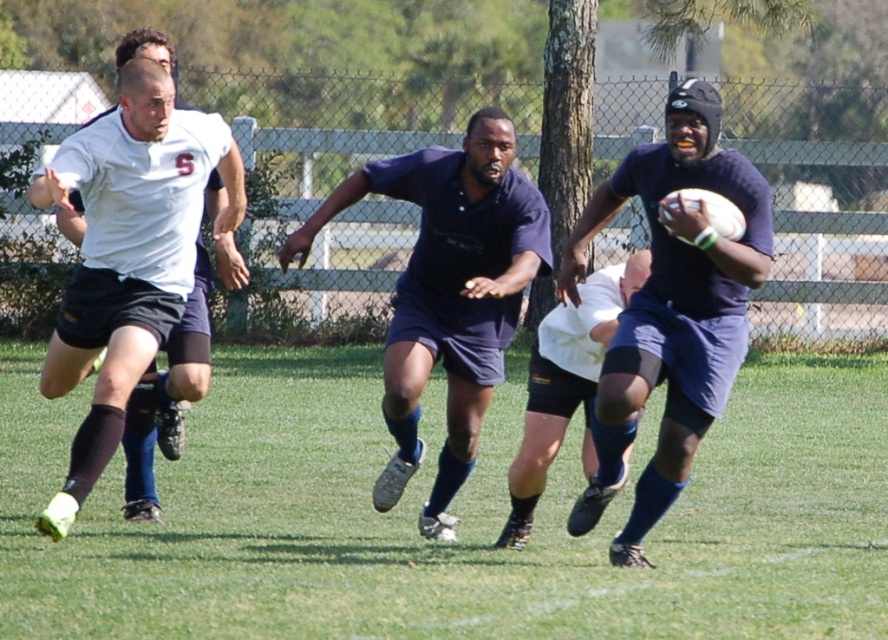
Which is behind, point (597, 545) or point (620, 339)?

The point (597, 545) is more distant.

Is point (720, 481) farther from camera compared to point (672, 109)?

That is True.

Is point (514, 632) farther from camera compared to point (592, 221)?

No, it is not.

The height and width of the screenshot is (640, 888). I want to click on green grass at center, so click(x=450, y=512).

Is dark blue jersey at center smaller than navy blue jersey at center?

Yes.

Can you confirm if dark blue jersey at center is positioned above navy blue jersey at center?

Yes, dark blue jersey at center is above navy blue jersey at center.

Measure the distance between point (639,182) and camera.

7.44 meters

Find the location of `dark blue jersey at center`. dark blue jersey at center is located at coordinates (671, 308).

Is point (472, 216) behind point (625, 298)?

No, it is in front of (625, 298).

Between navy blue jersey at center and white matte rugby ball at center, which one appears on the right side from the viewer's perspective?

Positioned to the right is white matte rugby ball at center.

Does point (411, 160) come farther from viewer compared to point (613, 278)?

No, (411, 160) is in front of (613, 278).

Where is `navy blue jersey at center`? The image size is (888, 640). navy blue jersey at center is located at coordinates (448, 292).